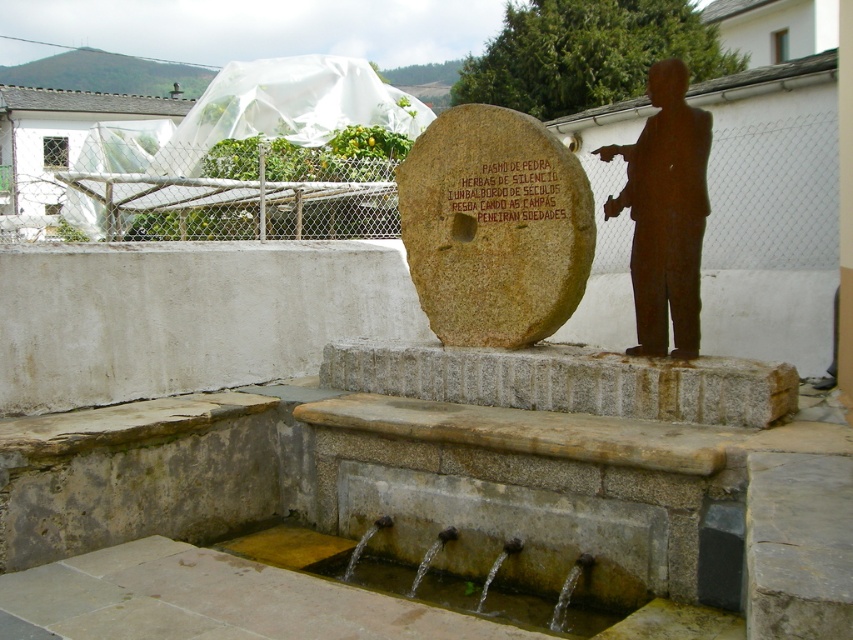
Does brown stone millstone at center come behind clear water at fountain lower?

Yes, brown stone millstone at center is behind clear water at fountain lower.

Can you confirm if brown stone millstone at center is shorter than clear water at fountain lower?

No, brown stone millstone at center is not shorter than clear water at fountain lower.

The height and width of the screenshot is (640, 853). Describe the element at coordinates (494, 227) in the screenshot. I see `brown stone millstone at center` at that location.

Image resolution: width=853 pixels, height=640 pixels. In order to click on brown stone millstone at center in this screenshot , I will do `click(494, 227)`.

Is rusty metal statue at right to the right of clear water at fountain lower from the viewer's perspective?

Correct, you'll find rusty metal statue at right to the right of clear water at fountain lower.

Does rusty metal statue at right lie behind clear water at fountain lower?

That is True.

Find the location of `rusty metal statue at right`. rusty metal statue at right is located at coordinates (665, 212).

Is brown stone millstone at center positioned in front of rusty metal statue at right?

No, brown stone millstone at center is further to the viewer.

Can you confirm if brown stone millstone at center is smaller than rusty metal statue at right?

No, brown stone millstone at center is not smaller than rusty metal statue at right.

Find the location of a particular element. This screenshot has width=853, height=640. brown stone millstone at center is located at coordinates (494, 227).